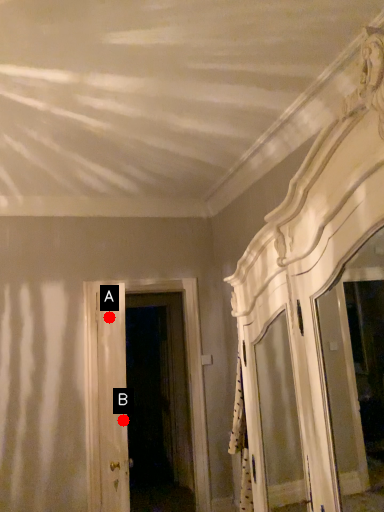
Question: Two points are circled on the image, labeled by A and B beside each circle. Which point appears farthest from the camera in this image?

Choices:
 (A) A is further
 (B) B is further

Answer: (B)